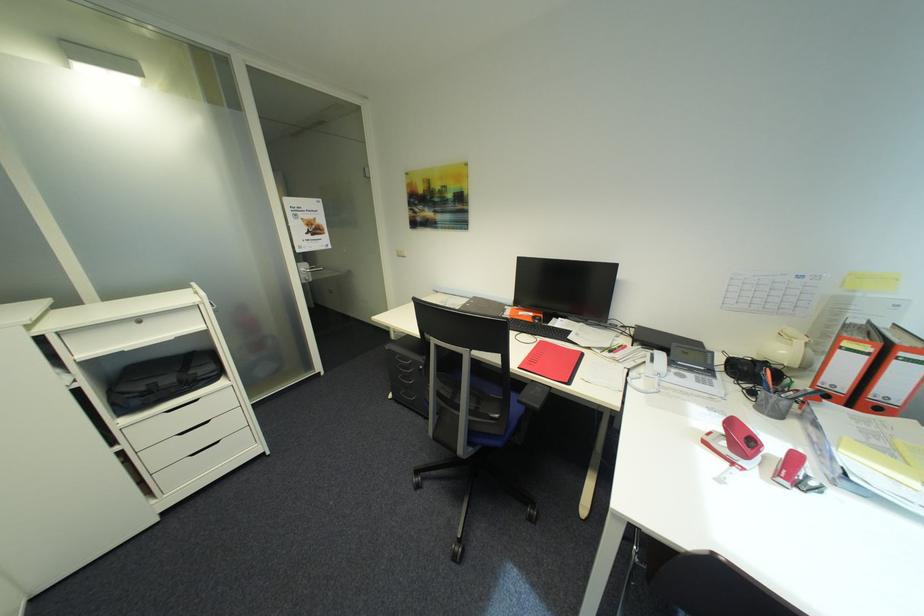
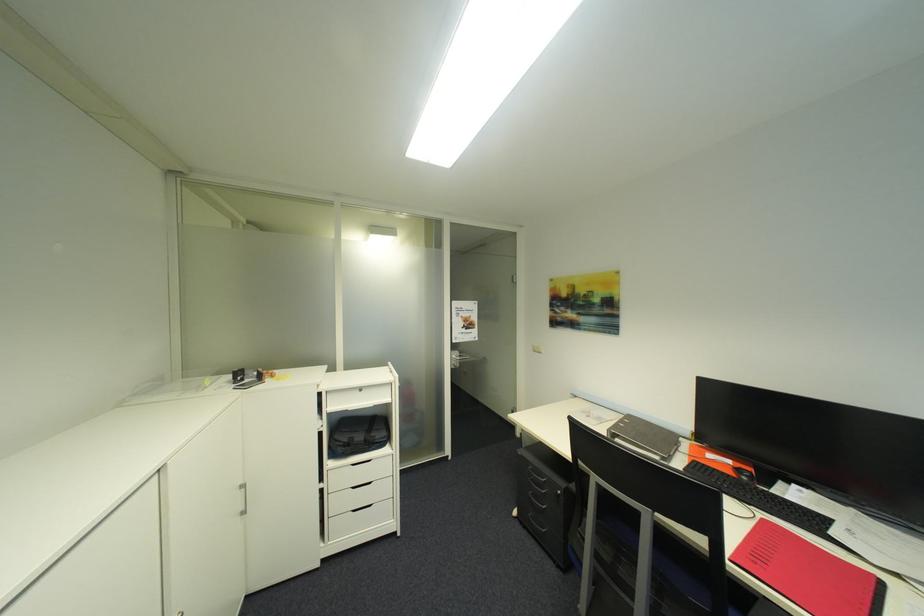
In the second image, find the point that corresponds to pixel 208 374 in the first image.

(384, 438)